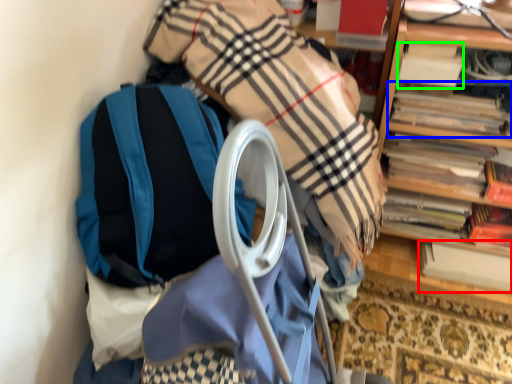
Question: Which is farther away from book (highlighted by a red box)? book (highlighted by a blue box) or book (highlighted by a green box)?

Choices:
 (A) book
 (B) book

Answer: (B)